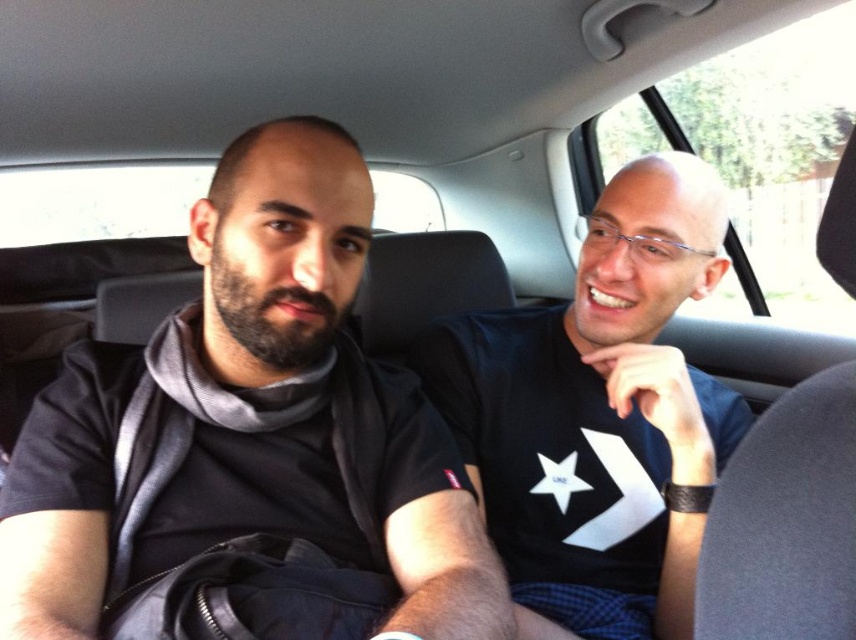
Question: Is black matte t-shirt at left to the right of black leather seat at center from the viewer's perspective?

Choices:
 (A) no
 (B) yes

Answer: (A)

Question: Is black matte t-shirt at left above blue fabric shirt at center?

Choices:
 (A) no
 (B) yes

Answer: (B)

Question: Which of the following is the farthest from the observer?

Choices:
 (A) (673, 547)
 (B) (376, 387)

Answer: (B)

Question: Which of the following is the farthest from the observer?

Choices:
 (A) (62, 420)
 (B) (749, 566)
 (C) (494, 397)

Answer: (C)

Question: Does black matte t-shirt at left have a larger size compared to black leather seat at center?

Choices:
 (A) yes
 (B) no

Answer: (A)

Question: Among these points, which one is nearest to the camera?

Choices:
 (A) (450, 417)
 (B) (339, 308)
 (C) (773, 502)

Answer: (C)